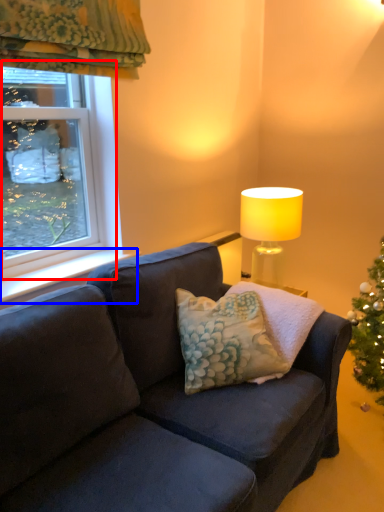
Question: Which object is further to the camera taking this photo, window (highlighted by a red box) or window sill (highlighted by a blue box)?

Choices:
 (A) window
 (B) window sill

Answer: (B)